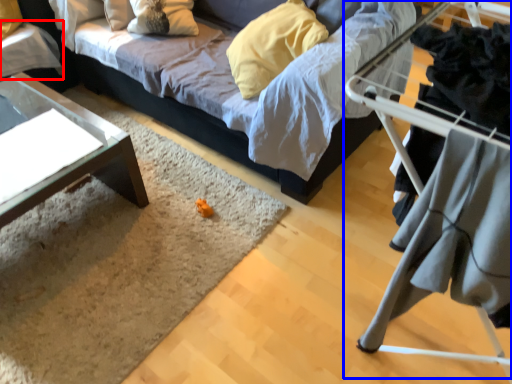
Question: Which object is further to the camera taking this photo, table (highlighted by a red box) or bunk bed (highlighted by a blue box)?

Choices:
 (A) table
 (B) bunk bed

Answer: (A)